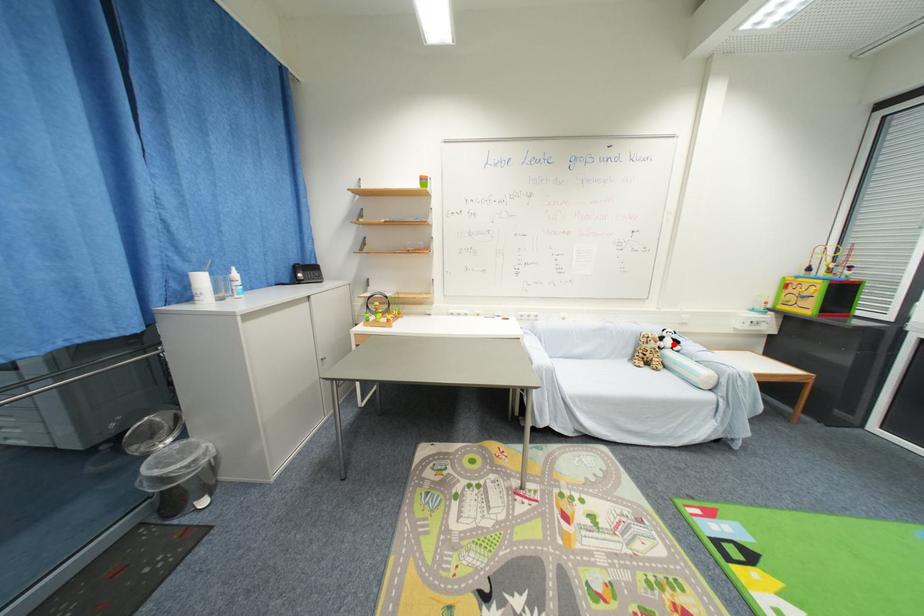
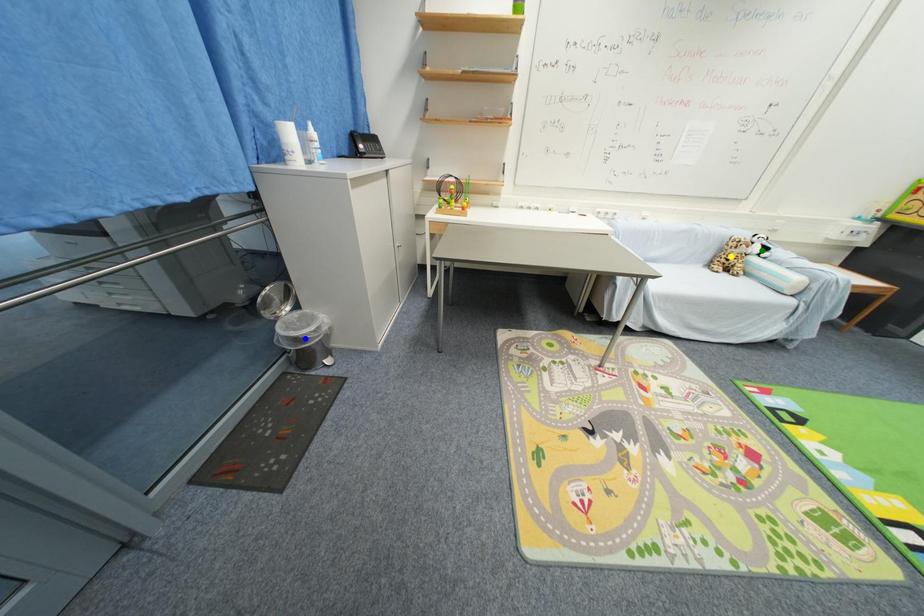
Question: I am providing you with two images of the same scene from different viewpoints. A red point is marked on the first image. You are given multiple points on the second image. In image 2, which mark is for the same physical point as the one in image 1?

Choices:
 (A) green point
 (B) yellow point
 (C) blue point

Answer: (A)